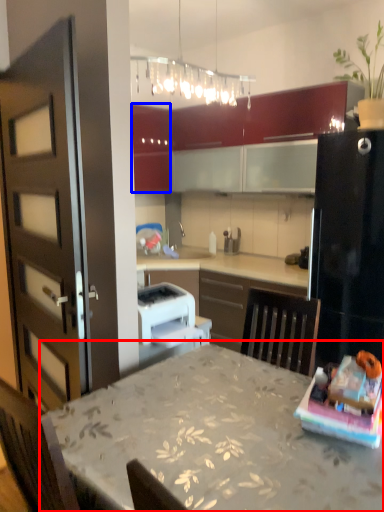
Question: Which of the following is the closest to the observer, table (highlighted by a red box) or cabinetry (highlighted by a blue box)?

Choices:
 (A) table
 (B) cabinetry

Answer: (A)